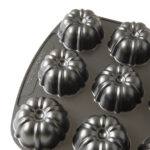
Identify the location of 6 racks. The image size is (150, 150). (30, 126), (53, 71), (72, 26), (125, 51), (115, 93), (90, 142).